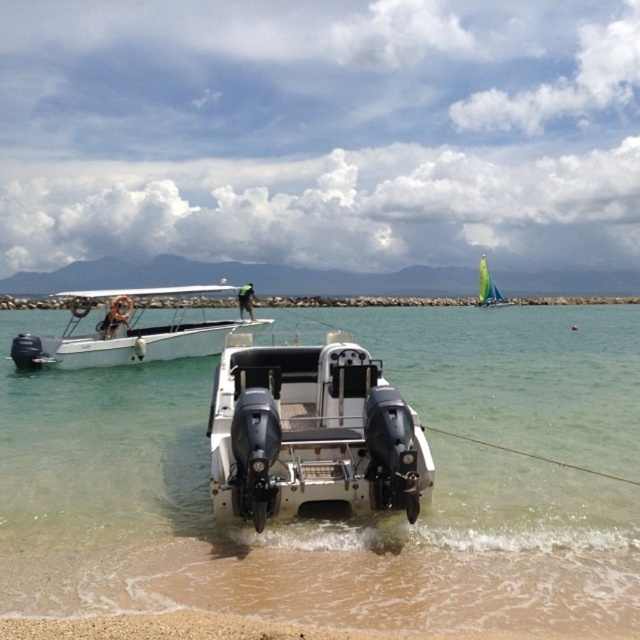
Question: Is clear water at boat front to the right of white sand at lower center from the viewer's perspective?

Choices:
 (A) yes
 (B) no

Answer: (B)

Question: Which object is positioned closest to the white sand at lower center?

Choices:
 (A) yellow sailboat at upper right
 (B) white matte boat at center
 (C) clear water at boat front

Answer: (A)

Question: Which of the following is the farthest from the observer?

Choices:
 (A) (481, 301)
 (B) (44, 307)

Answer: (A)

Question: Which point is closer to the camera?

Choices:
 (A) pos(483,260)
 (B) pos(593,300)
 (C) pos(147,300)
 (D) pos(144,547)

Answer: (D)

Question: Can you confirm if white matte boat at center is wider than white matte boat at upper left?

Choices:
 (A) no
 (B) yes

Answer: (A)

Question: Does white matte boat at center have a greater width compared to yellow sailboat at upper right?

Choices:
 (A) yes
 (B) no

Answer: (B)